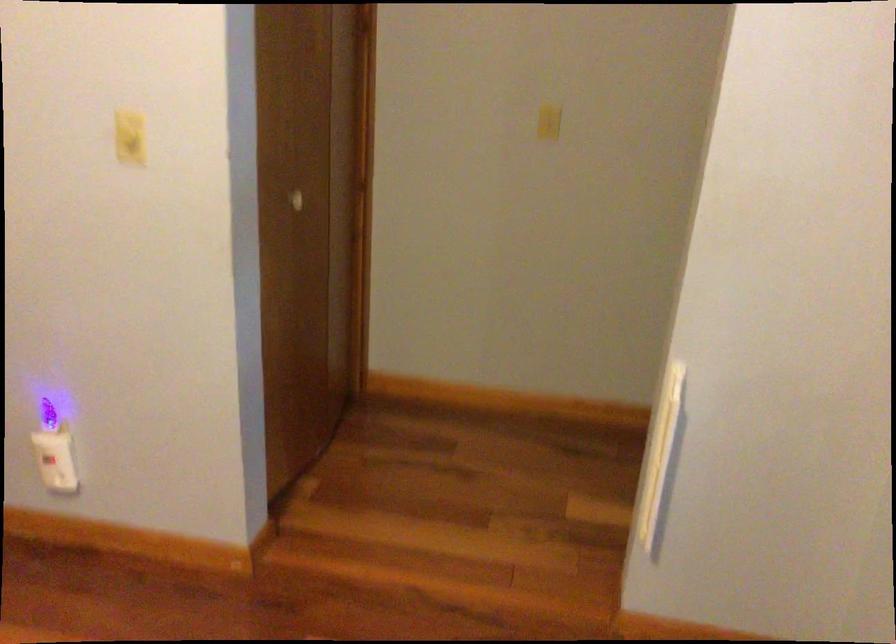
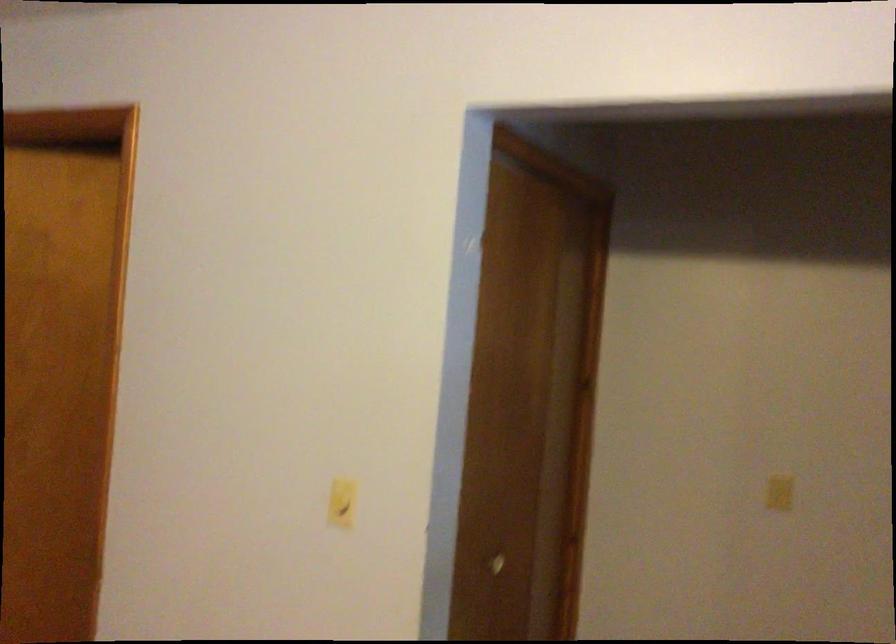
The first image is from the beginning of the video and the second image is from the end. How did the camera likely rotate when shooting the video?

The camera's rotation is toward left-up.